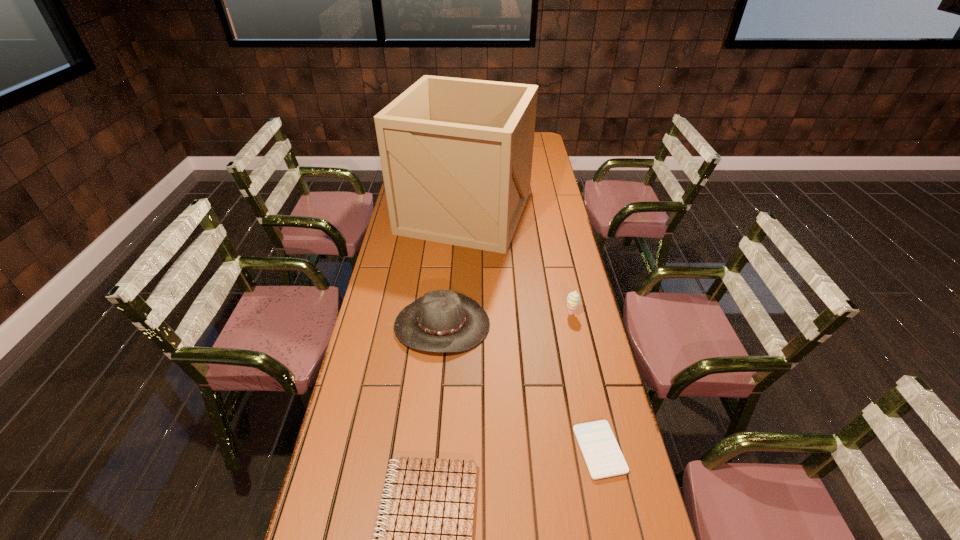
Where is `the tallest object`? the tallest object is located at coordinates (456, 154).

In order to click on the farthest object in this screenshot , I will do `click(456, 154)`.

This screenshot has width=960, height=540. Find the location of `hat`. hat is located at coordinates pos(441,321).

Find the location of a particular element. Image resolution: width=960 pixels, height=540 pixels. sherbert is located at coordinates (573, 298).

Identify the location of the shortest object. This screenshot has height=540, width=960. (601, 452).

The image size is (960, 540). Identify the location of free region located on the right of the farthest object. (560, 212).

You are a GUI agent. You are given a task and a screenshot of the screen. Output one action in this format:
    pyautogui.click(x=<x>, y=<y>)
    Task: Click on the vacant region located 0.370m on the front-facing side of the hat
    This screenshot has height=540, width=960.
    Given the screenshot: What is the action you would take?
    pyautogui.click(x=429, y=480)

The image size is (960, 540). Find the location of `vacant space positioned on the left of the sherbert`. vacant space positioned on the left of the sherbert is located at coordinates (447, 314).

Find the location of `free region located on the back of the calculator`. free region located on the back of the calculator is located at coordinates (580, 359).

Where is `box at the left edge`? box at the left edge is located at coordinates (456, 154).